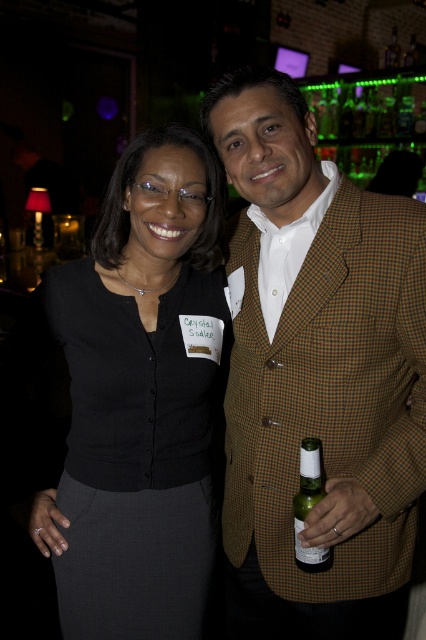
You are a photographer at a social event. You need to adjust the lighting to highlight the black fabric skirt at center and the green glass bottle at center. Which object should you focus on first if you want to ensure the one closer to the camera is properly lit?

The black fabric skirt at center is above the green glass bottle at center, so it is closer to the camera. Focus on lighting the black fabric skirt at center first to ensure proper exposure.

What is the color and pattern of the clothing item located at the coordinates point (317, 376) in the image?

The point (317, 376) corresponds to the brown checkered blazer at center.

You are a bartender at the event and need to place the green glass bottle at center on a shelf that can only hold items smaller than the brown checkered blazer at center. Can the bottle fit?

The brown checkered blazer at center is larger in size than the green glass bottle at center, so the green glass bottle at center can fit on the shelf since it is smaller than the blazer.